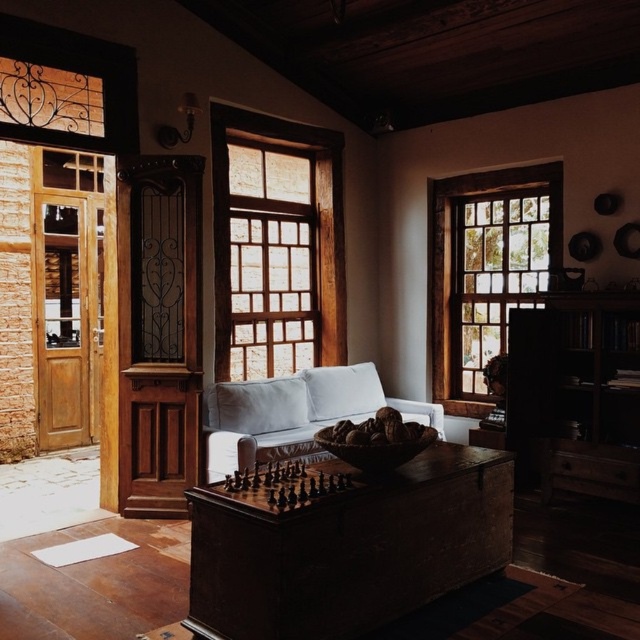
What do you see at coordinates (576, 394) in the screenshot? Image resolution: width=640 pixels, height=640 pixels. I see `wooden bookshelf at right` at bounding box center [576, 394].

Can you confirm if wooden bookshelf at right is thinner than light gray fabric couch at center?

Indeed, wooden bookshelf at right has a lesser width compared to light gray fabric couch at center.

Describe the element at coordinates (576, 394) in the screenshot. I see `wooden bookshelf at right` at that location.

At what (x,y) coordinates should I click in order to perform the action: click on wooden bookshelf at right. Please return your answer as a coordinate pair (x, y). This screenshot has height=640, width=640. Looking at the image, I should click on (576, 394).

Can you confirm if light gray fabric couch at center is positioned below wooden frame at center?

Correct, light gray fabric couch at center is located below wooden frame at center.

Is light gray fabric couch at center to the left of wooden frame at center from the viewer's perspective?

No, light gray fabric couch at center is not to the left of wooden frame at center.

Is point (372, 385) farther from camera compared to point (216, 212)?

That is True.

Image resolution: width=640 pixels, height=640 pixels. Find the location of `light gray fabric couch at center`. light gray fabric couch at center is located at coordinates (294, 413).

Between wooden bookshelf at right and wooden frame at center, which one is positioned lower?

Positioned lower is wooden bookshelf at right.

Is the position of wooden bookshelf at right more distant than that of wooden frame at center?

No, wooden bookshelf at right is in front of wooden frame at center.

Image resolution: width=640 pixels, height=640 pixels. Identify the location of wooden bookshelf at right. (576, 394).